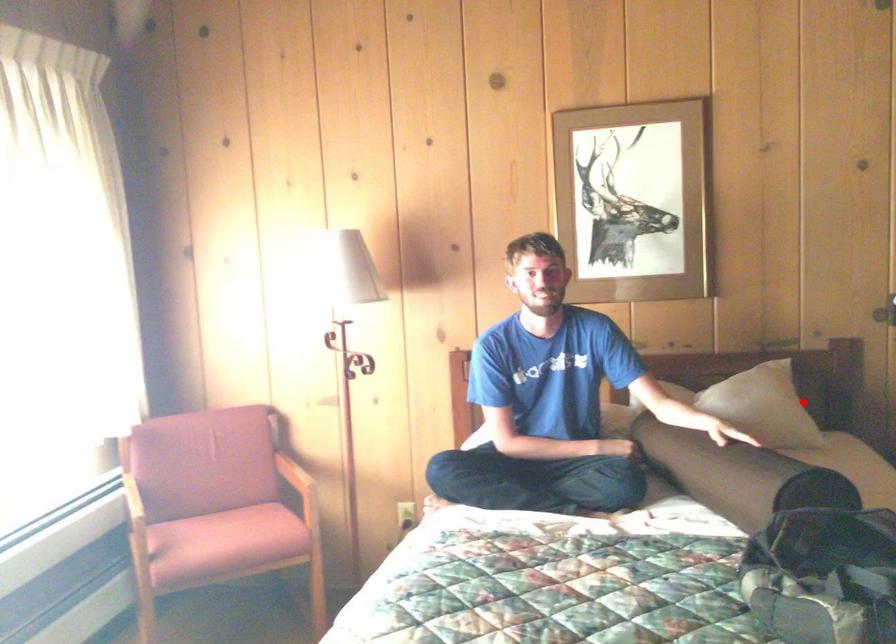
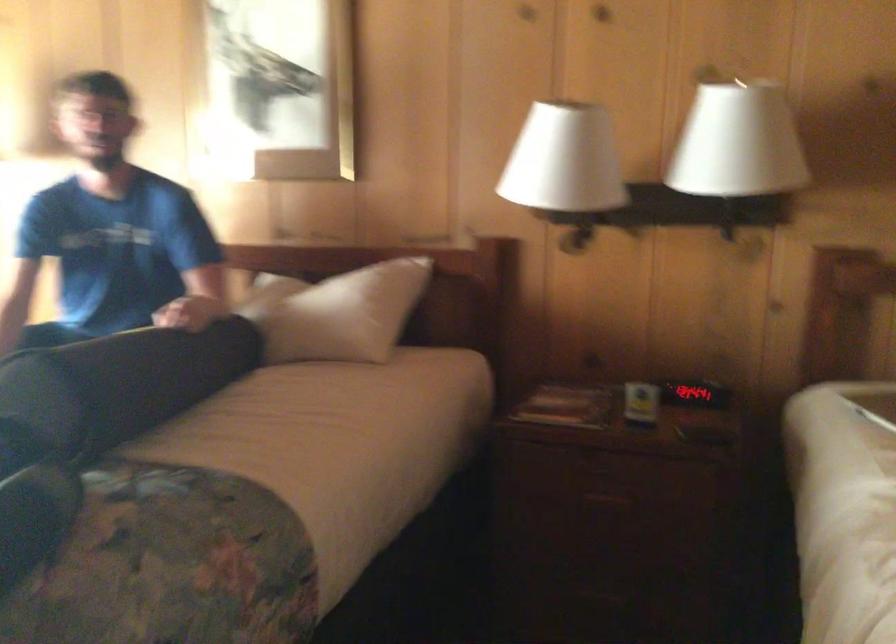
Find the pixel in the second image that matches the highlighted location in the first image.

(340, 313)